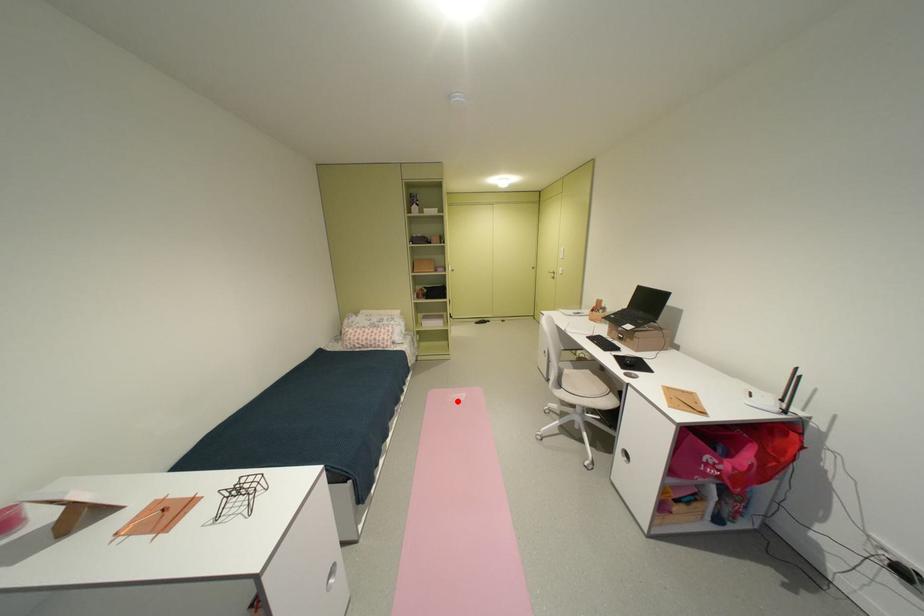
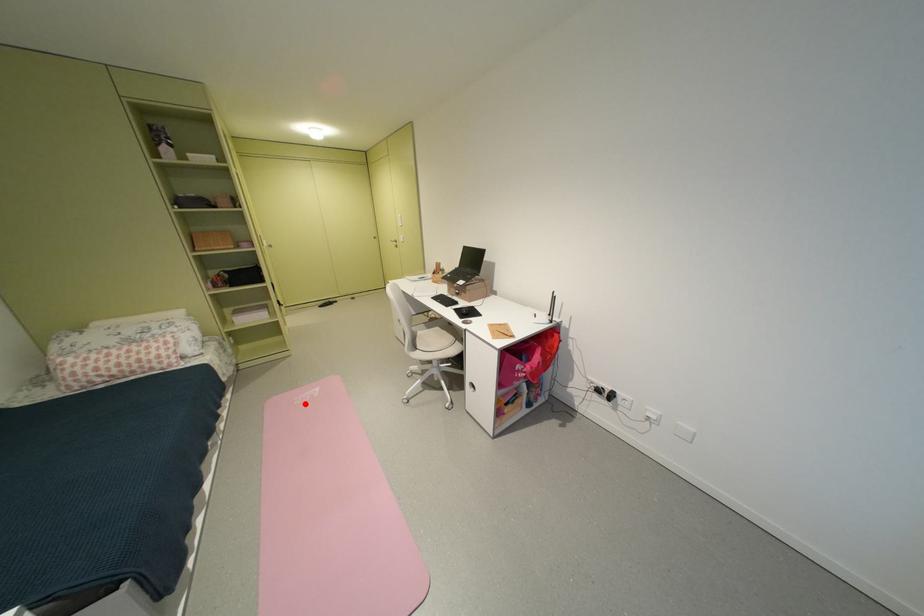
I am providing you with two images of the same scene from different viewpoints. A red point is marked on the first image and another point is marked on the second image. Does the point marked in image1 correspond to the same location as the one in image2?

Yes